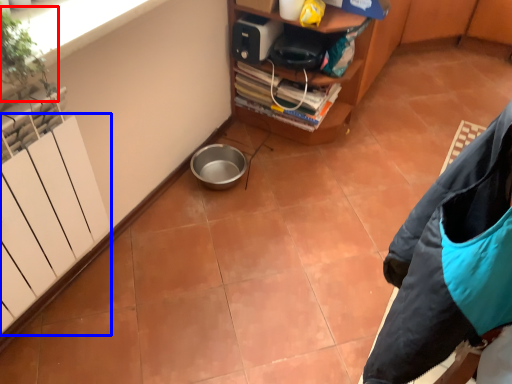
Question: Which object is further to the camera taking this photo, plant (highlighted by a red box) or radiator (highlighted by a blue box)?

Choices:
 (A) plant
 (B) radiator

Answer: (A)